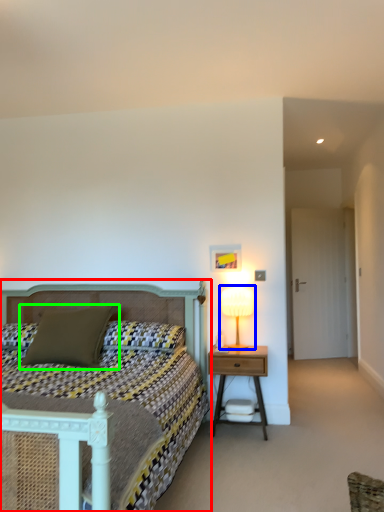
Question: Which object is the farthest from bed (highlighted by a red box)? Choose among these: table lamp (highlighted by a blue box) or pillow (highlighted by a green box).

Choices:
 (A) table lamp
 (B) pillow

Answer: (A)